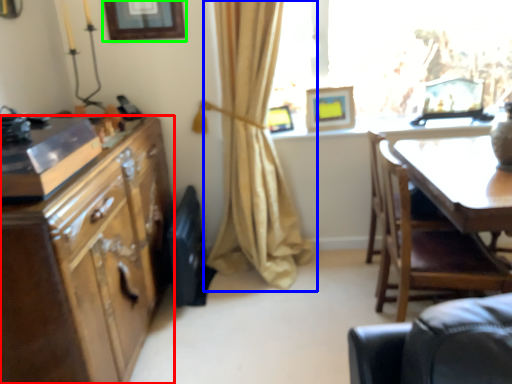
Question: Which object is the closest to the cabinetry (highlighted by a red box)? Choose among these: curtain (highlighted by a blue box) or picture frame (highlighted by a green box).

Choices:
 (A) curtain
 (B) picture frame

Answer: (A)